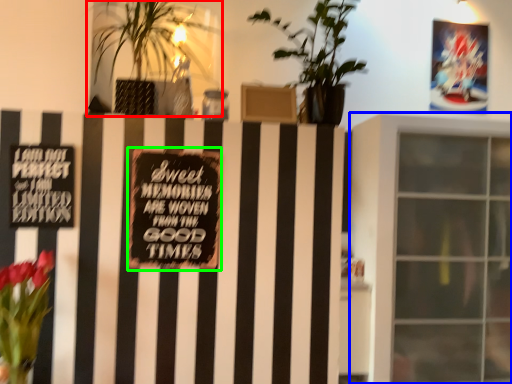
Question: Which object is the closest to the houseplant (highlighted by a red box)? Choose among these: window (highlighted by a blue box) or plaque (highlighted by a green box).

Choices:
 (A) window
 (B) plaque

Answer: (A)